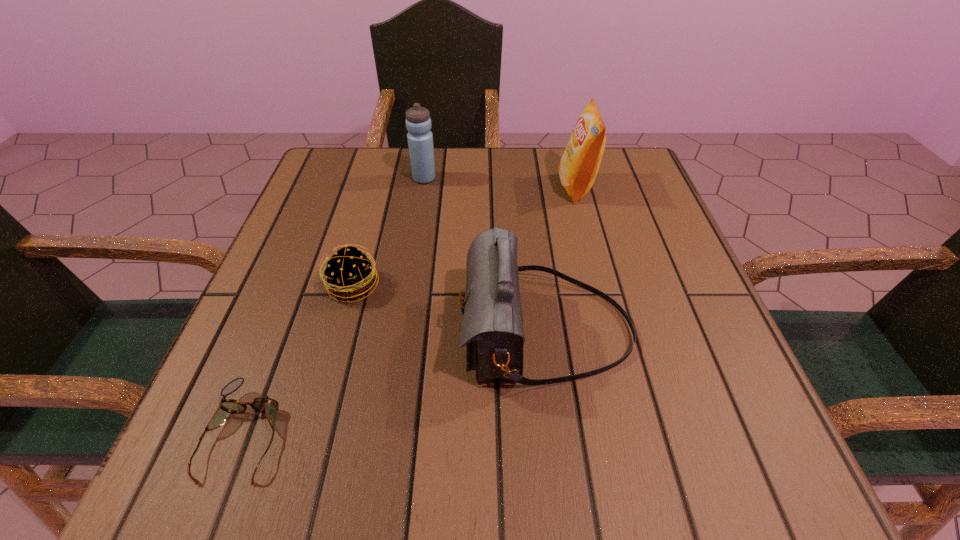
Where is `vacant space in between the second shortest object and the shoulder bag`? The width and height of the screenshot is (960, 540). vacant space in between the second shortest object and the shoulder bag is located at coordinates (449, 308).

Locate an element on the screen. The width and height of the screenshot is (960, 540). free space that is in between the patty and the shoulder bag is located at coordinates (449, 308).

Where is `vacant region between the spectacles and the crisp (potato chip)`? The width and height of the screenshot is (960, 540). vacant region between the spectacles and the crisp (potato chip) is located at coordinates (411, 310).

I want to click on vacant region between the third object from right to left and the second shortest object, so click(389, 232).

Where is `empty space between the fourth tallest object and the spectacles`? empty space between the fourth tallest object and the spectacles is located at coordinates (300, 360).

Locate which object is the third closest to the fourth tallest object. Please provide its 2D coordinates. Your answer should be formatted as a tuple, i.e. [(x, y)], where the tuple contains the x and y coordinates of a point satisfying the conditions above.

[(420, 139)]

Identify which object is located as the fourth nearest to the shortest object. Please provide its 2D coordinates. Your answer should be formatted as a tuple, i.e. [(x, y)], where the tuple contains the x and y coordinates of a point satisfying the conditions above.

[(578, 167)]

The image size is (960, 540). Identify the location of free region that satisfies the following two spatial constraints: 1. on the back side of the water bottle; 2. on the left side of the fourth tallest object. (382, 178).

Find the location of a particular element. free location that satisfies the following two spatial constraints: 1. on the front-facing side of the crisp (potato chip); 2. on the front-facing side of the shortest object is located at coordinates (640, 433).

Find the location of a particular element. This screenshot has width=960, height=540. free space that satisfies the following two spatial constraints: 1. on the front-facing side of the crisp (potato chip); 2. on the front-facing side of the spectacles is located at coordinates (640, 433).